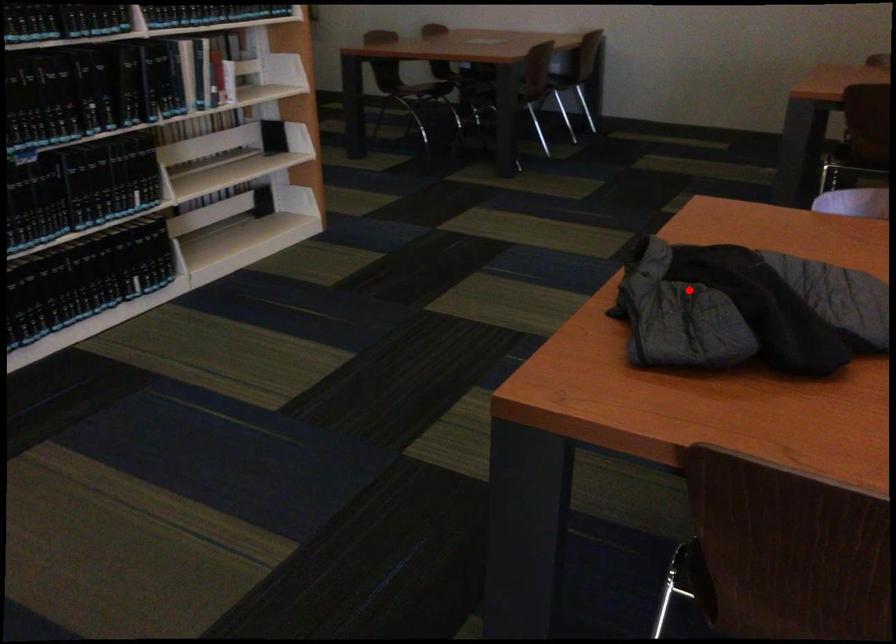
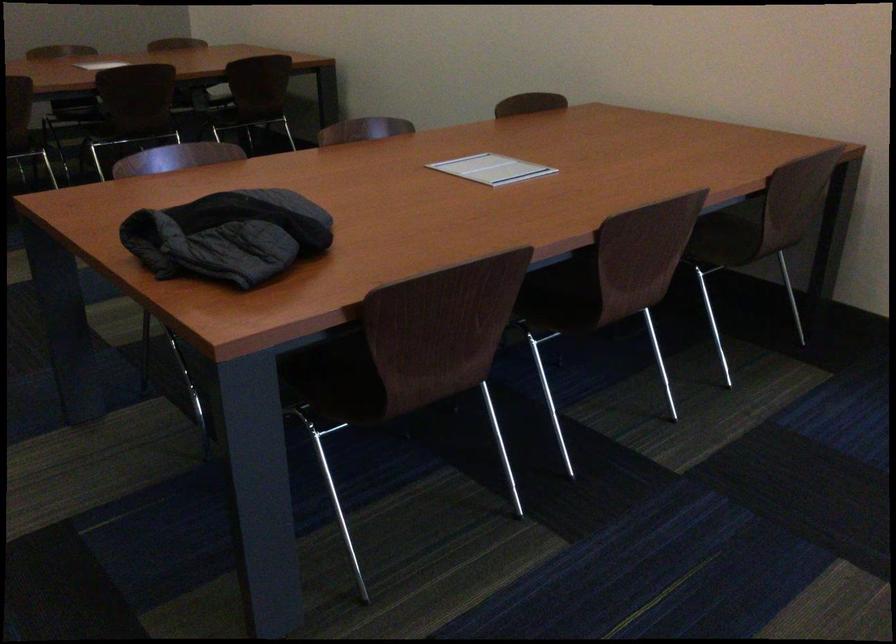
In the second image, find the point that corresponds to the highlighted location in the first image.

(228, 236)